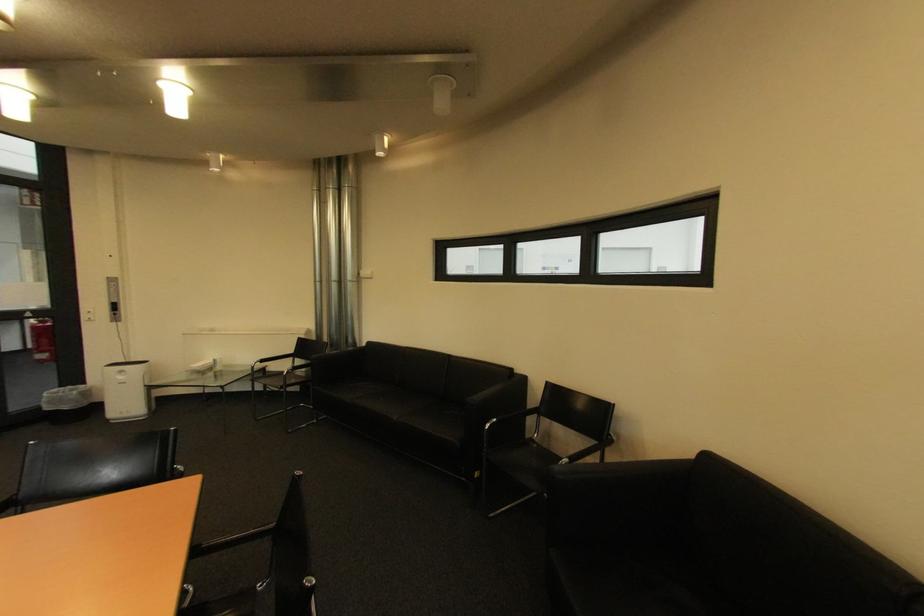
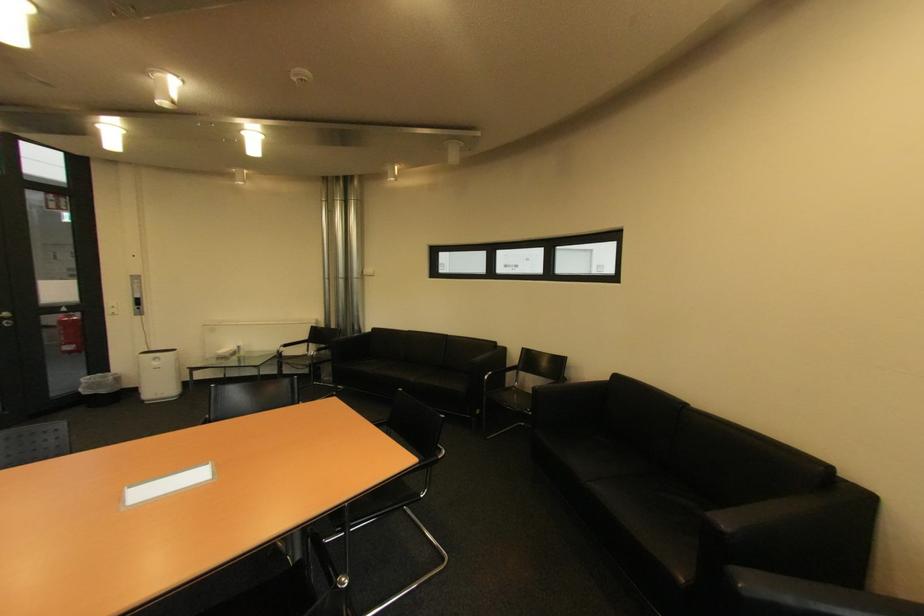
Locate, in the second image, the point that corresponds to the point at 129,379 in the first image.

(164, 363)